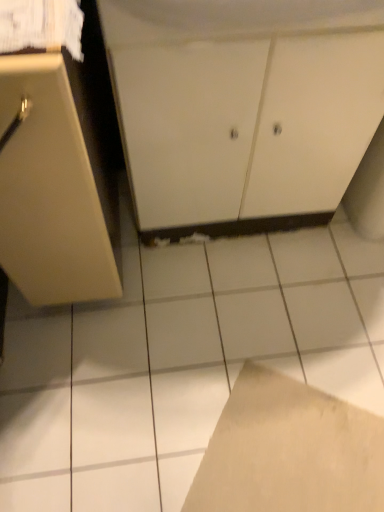
Question: Is white matte cabinet at center, which is counted as the second cabinetry, starting from the left, located outside matte beige cabinet at left, marked as the first cabinetry in a left-to-right arrangement?

Choices:
 (A) yes
 (B) no

Answer: (A)

Question: From a real-world perspective, is white matte cabinet at center, which is counted as the second cabinetry, starting from the left, located beneath matte beige cabinet at left, which is counted as the 2th cabinetry, starting from the right?

Choices:
 (A) yes
 (B) no

Answer: (A)

Question: Can you confirm if white matte cabinet at center, positioned as the 1th cabinetry in right-to-left order, is taller than matte beige cabinet at left, which is counted as the 2th cabinetry, starting from the right?

Choices:
 (A) no
 (B) yes

Answer: (A)

Question: Does white matte cabinet at center, which is counted as the second cabinetry, starting from the left, appear on the right side of matte beige cabinet at left, which is counted as the 2th cabinetry, starting from the right?

Choices:
 (A) no
 (B) yes

Answer: (B)

Question: Is white matte cabinet at center, positioned as the 1th cabinetry in right-to-left order, shorter than matte beige cabinet at left, which is counted as the 2th cabinetry, starting from the right?

Choices:
 (A) yes
 (B) no

Answer: (A)

Question: Is white matte cabinet at center, positioned as the 1th cabinetry in right-to-left order, in front of matte beige cabinet at left, which is counted as the 2th cabinetry, starting from the right?

Choices:
 (A) no
 (B) yes

Answer: (A)

Question: From the image's perspective, is brown cardboard at lower center above white glossy tile at center?

Choices:
 (A) no
 (B) yes

Answer: (A)

Question: From the image's perspective, is brown cardboard at lower center under white glossy tile at center?

Choices:
 (A) no
 (B) yes

Answer: (B)

Question: From a real-world perspective, is brown cardboard at lower center under white glossy tile at center?

Choices:
 (A) no
 (B) yes

Answer: (B)

Question: From a real-world perspective, is brown cardboard at lower center physically above white glossy tile at center?

Choices:
 (A) yes
 (B) no

Answer: (B)

Question: Is brown cardboard at lower center oriented away from white glossy tile at center?

Choices:
 (A) yes
 (B) no

Answer: (A)

Question: Is brown cardboard at lower center closer to camera compared to white glossy tile at center?

Choices:
 (A) no
 (B) yes

Answer: (B)

Question: Can you confirm if brown cardboard at lower center is thinner than matte beige cabinet at left, which is counted as the 2th cabinetry, starting from the right?

Choices:
 (A) no
 (B) yes

Answer: (B)